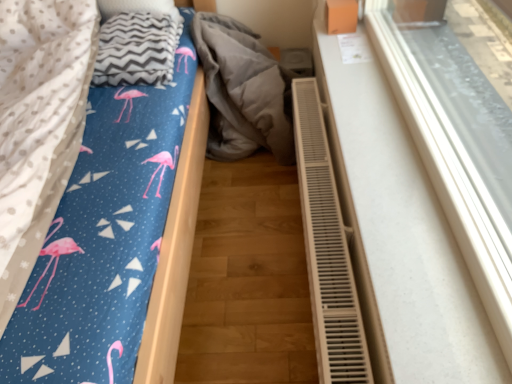
Question: Relative to flamingo-patterned fabric at left, is blue fabric bed at center in front or behind?

Choices:
 (A) behind
 (B) front

Answer: (B)

Question: In terms of size, does blue fabric bed at center appear bigger or smaller than flamingo-patterned fabric at left?

Choices:
 (A) small
 (B) big

Answer: (B)

Question: Which of these objects is positioned farthest from the gray zigzag blanket at upper left?

Choices:
 (A) white plastic radiator at right
 (B) flamingo-patterned fabric at left
 (C) gray fabric at center
 (D) blue fabric bed at center
 (E) white plastic radiator at lower right

Answer: (A)

Question: Which object is the closest to the white plastic radiator at right?

Choices:
 (A) white plastic radiator at lower right
 (B) flamingo-patterned fabric at left
 (C) gray fabric at center
 (D) gray zigzag blanket at upper left
 (E) blue fabric bed at center

Answer: (A)